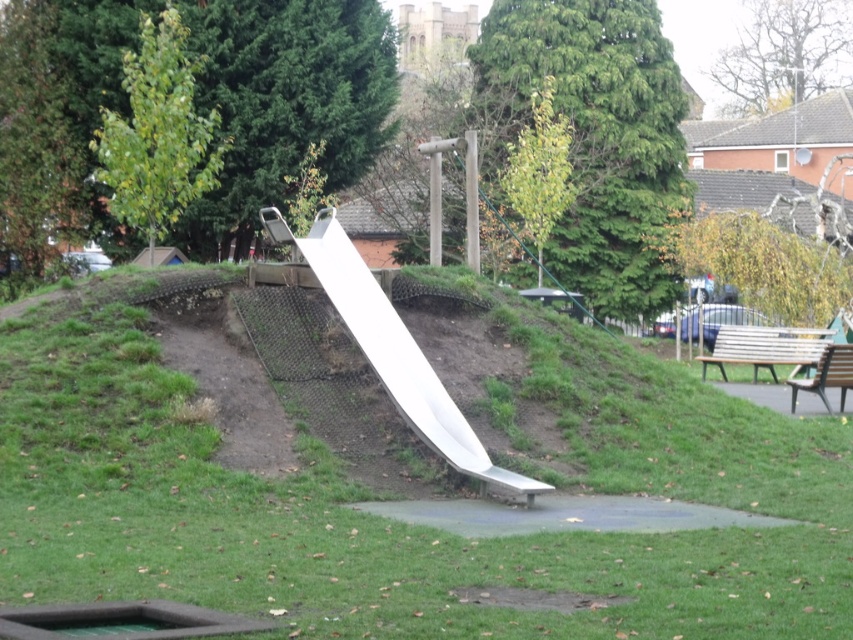
Which is more to the right, white metallic slide at center or brown wooden bench at right?

From the viewer's perspective, brown wooden bench at right appears more on the right side.

Image resolution: width=853 pixels, height=640 pixels. What do you see at coordinates (393, 349) in the screenshot?
I see `white metallic slide at center` at bounding box center [393, 349].

This screenshot has height=640, width=853. In order to click on white metallic slide at center in this screenshot , I will do `click(393, 349)`.

I want to click on white metallic slide at center, so click(x=393, y=349).

In the scene shown: Does white metallic slide at center have a greater width compared to wooden bench at right?

Yes, white metallic slide at center is wider than wooden bench at right.

What do you see at coordinates (393, 349) in the screenshot?
I see `white metallic slide at center` at bounding box center [393, 349].

Find the location of a particular element. The width and height of the screenshot is (853, 640). white metallic slide at center is located at coordinates (393, 349).

How distant is wooden bench at right from brown wooden bench at right?

A distance of 11.19 feet exists between wooden bench at right and brown wooden bench at right.

Is wooden bench at right to the right of brown wooden bench at right from the viewer's perspective?

Indeed, wooden bench at right is positioned on the right side of brown wooden bench at right.

Locate an element on the screen. wooden bench at right is located at coordinates (764, 348).

Identify the location of wooden bench at right. The width and height of the screenshot is (853, 640). (764, 348).